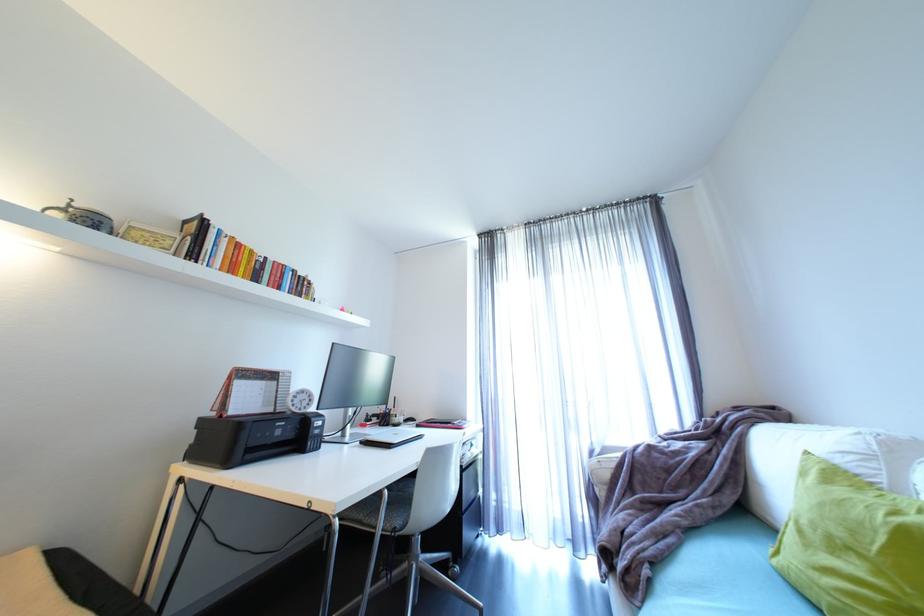
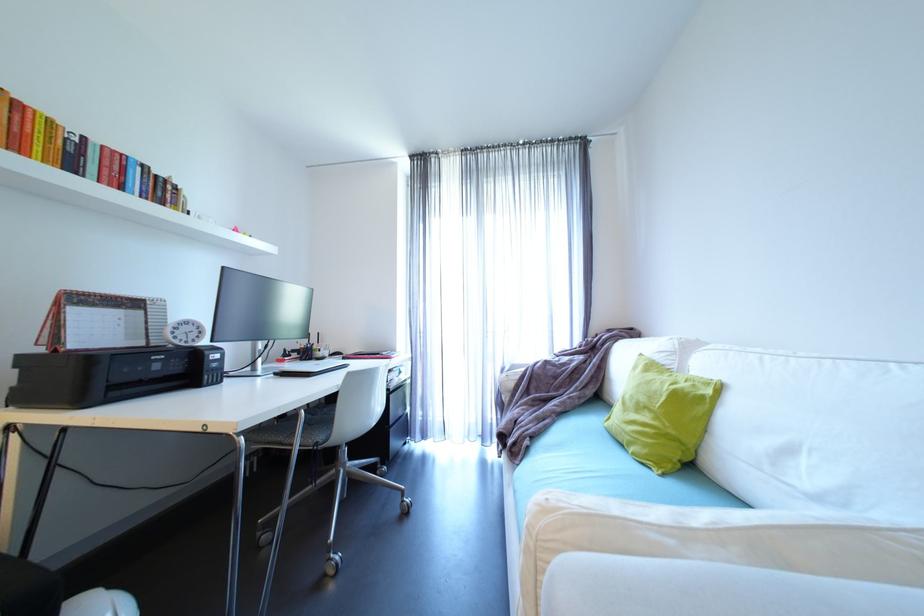
Question: The first image is from the beginning of the video and the second image is from the end. How did the camera likely rotate when shooting the video?

Choices:
 (A) Left
 (B) Right
 (C) Up
 (D) Down

Answer: (B)